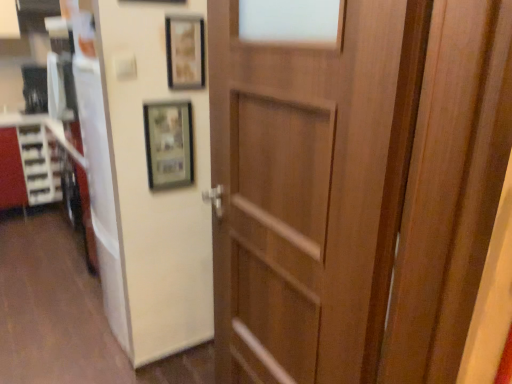
You are a GUI agent. You are given a task and a screenshot of the screen. Output one action in this format:
    pyautogui.click(x=<x>, y=<y>)
    Task: Click on the wooden door at center
    
    Given the screenshot: What is the action you would take?
    pyautogui.click(x=357, y=191)

Locate an element on the screen. This screenshot has width=512, height=384. matte wooden picture frame at upper center, which is the 2th picture frame from top to bottom is located at coordinates (169, 144).

This screenshot has width=512, height=384. What do you see at coordinates (11, 171) in the screenshot? I see `matte white cabinet at left` at bounding box center [11, 171].

I want to click on matte white cabinet at left, so click(x=11, y=171).

Locate an element on the screen. Image resolution: width=512 pixels, height=384 pixels. wooden frame at upper center, positioned as the second picture frame in bottom-to-top order is located at coordinates (185, 52).

Is wooden frame at upper center, which appears as the first picture frame when viewed from the top, surrounded by matte wooden picture frame at upper center, which is the 2th picture frame from top to bottom?

No.

How many degrees apart are the facing directions of matte wooden picture frame at upper center, the 1th picture frame positioned from the bottom, and wooden frame at upper center, positioned as the second picture frame in bottom-to-top order?

There is a 0.00366-degree angle between the facing directions of matte wooden picture frame at upper center, the 1th picture frame positioned from the bottom, and wooden frame at upper center, positioned as the second picture frame in bottom-to-top order.

Image resolution: width=512 pixels, height=384 pixels. What are the coordinates of `picture frame on the left of wooden frame at upper center, which appears as the first picture frame when viewed from the top` in the screenshot? It's located at (169, 144).

Is the position of matte wooden picture frame at upper center, which is the 2th picture frame from top to bottom, more distant than that of wooden frame at upper center, positioned as the second picture frame in bottom-to-top order?

Yes, matte wooden picture frame at upper center, which is the 2th picture frame from top to bottom, is further from the viewer.

Considering the relative sizes of wooden frame at upper center, positioned as the second picture frame in bottom-to-top order, and matte wooden picture frame at upper center, which is the 2th picture frame from top to bottom, in the image provided, is wooden frame at upper center, positioned as the second picture frame in bottom-to-top order, thinner than matte wooden picture frame at upper center, which is the 2th picture frame from top to bottom,?

No.

How far apart are wooden frame at upper center, which appears as the first picture frame when viewed from the top, and matte wooden picture frame at upper center, the 1th picture frame positioned from the bottom?

9.19 inches.

Which of these two, wooden frame at upper center, positioned as the second picture frame in bottom-to-top order, or matte wooden picture frame at upper center, the 1th picture frame positioned from the bottom, is bigger?

matte wooden picture frame at upper center, the 1th picture frame positioned from the bottom, is bigger.

Is wooden frame at upper center, which appears as the first picture frame when viewed from the top, facing towards matte wooden picture frame at upper center, which is the 2th picture frame from top to bottom?

No, wooden frame at upper center, which appears as the first picture frame when viewed from the top, is not aimed at matte wooden picture frame at upper center, which is the 2th picture frame from top to bottom.

Does point (464, 20) come farther from viewer compared to point (15, 164)?

No, (464, 20) is closer to viewer.

Is wooden door at center positioned in front of matte white cabinet at left?

That is True.

Considering the positions of objects wooden door at center and matte white cabinet at left in the image provided, who is more to the left, wooden door at center or matte white cabinet at left?

From the viewer's perspective, matte white cabinet at left appears more on the left side.

From a real-world perspective, which object rests below the other?

matte white cabinet at left, from a real-world perspective.

Can we say matte white cabinet at left lies outside wooden frame at upper center, positioned as the second picture frame in bottom-to-top order?

Yes.

Considering the relative sizes of matte white cabinet at left and wooden frame at upper center, which appears as the first picture frame when viewed from the top, in the image provided, is matte white cabinet at left shorter than wooden frame at upper center, which appears as the first picture frame when viewed from the top,?

No, matte white cabinet at left is not shorter than wooden frame at upper center, which appears as the first picture frame when viewed from the top.

Locate an element on the screen. The width and height of the screenshot is (512, 384). cabinetry directly beneath the wooden frame at upper center, which appears as the first picture frame when viewed from the top (from a real-world perspective) is located at coordinates (11, 171).

Is matte white cabinet at left next to wooden frame at upper center, positioned as the second picture frame in bottom-to-top order?

No, matte white cabinet at left is not in contact with wooden frame at upper center, positioned as the second picture frame in bottom-to-top order.

Is matte white cabinet at left completely or partially inside matte wooden picture frame at upper center, which is the 2th picture frame from top to bottom?

No.

Is point (150, 116) closer to camera compared to point (22, 176)?

Yes, point (150, 116) is in front of point (22, 176).

Could you tell me if matte wooden picture frame at upper center, which is the 2th picture frame from top to bottom, is facing matte white cabinet at left?

No.

From a real-world perspective, is matte white cabinet at left beneath wooden door at center?

Yes, from a real-world perspective, matte white cabinet at left is below wooden door at center.

Is point (11, 170) behind point (244, 69)?

That is True.

Would you say matte white cabinet at left contains wooden door at center?

No, wooden door at center is not a part of matte white cabinet at left.

Based on their positions, is matte white cabinet at left located to the left or right of wooden door at center?

matte white cabinet at left is to the left of wooden door at center.

Is wooden frame at upper center, positioned as the second picture frame in bottom-to-top order, located outside matte white cabinet at left?

Yes, wooden frame at upper center, positioned as the second picture frame in bottom-to-top order, is outside of matte white cabinet at left.

Can you confirm if wooden frame at upper center, positioned as the second picture frame in bottom-to-top order, is thinner than matte white cabinet at left?

Correct, the width of wooden frame at upper center, positioned as the second picture frame in bottom-to-top order, is less than that of matte white cabinet at left.

Which object is positioned more to the right, wooden frame at upper center, positioned as the second picture frame in bottom-to-top order, or matte white cabinet at left?

From the viewer's perspective, wooden frame at upper center, positioned as the second picture frame in bottom-to-top order, appears more on the right side.

Could you tell me if wooden frame at upper center, which appears as the first picture frame when viewed from the top, is facing matte white cabinet at left?

No, wooden frame at upper center, which appears as the first picture frame when viewed from the top, is not aimed at matte white cabinet at left.

You are a GUI agent. You are given a task and a screenshot of the screen. Output one action in this format:
    pyautogui.click(x=<x>, y=<y>)
    Task: Click on the picture frame below the wooden frame at upper center, which appears as the first picture frame when viewed from the top (from a real-world perspective)
    Image resolution: width=512 pixels, height=384 pixels.
    Given the screenshot: What is the action you would take?
    pyautogui.click(x=169, y=144)

Where is `picture frame above the matte wooden picture frame at upper center, the 1th picture frame positioned from the bottom (from the image's perspective)`? The width and height of the screenshot is (512, 384). picture frame above the matte wooden picture frame at upper center, the 1th picture frame positioned from the bottom (from the image's perspective) is located at coordinates (185, 52).

Looking at the image, which one is located further to matte white cabinet at left, wooden frame at upper center, which appears as the first picture frame when viewed from the top, or wooden door at center?

wooden door at center is further to matte white cabinet at left.

Considering their positions, is matte wooden picture frame at upper center, the 1th picture frame positioned from the bottom, positioned further to wooden frame at upper center, which appears as the first picture frame when viewed from the top, than matte white cabinet at left?

The object further to wooden frame at upper center, which appears as the first picture frame when viewed from the top, is matte white cabinet at left.

When comparing their distances from wooden door at center, does matte wooden picture frame at upper center, which is the 2th picture frame from top to bottom, or matte white cabinet at left seem further?

matte white cabinet at left is positioned further to the anchor wooden door at center.

Which object lies further to the anchor point wooden door at center, wooden frame at upper center, positioned as the second picture frame in bottom-to-top order, or matte white cabinet at left?

Based on the image, matte white cabinet at left appears to be further to wooden door at center.

From the image, which object appears to be nearer to matte wooden picture frame at upper center, which is the 2th picture frame from top to bottom, wooden frame at upper center, which appears as the first picture frame when viewed from the top, or wooden door at center?

Among the two, wooden frame at upper center, which appears as the first picture frame when viewed from the top, is located nearer to matte wooden picture frame at upper center, which is the 2th picture frame from top to bottom.

Considering their positions, is wooden frame at upper center, which appears as the first picture frame when viewed from the top, positioned closer to matte white cabinet at left than matte wooden picture frame at upper center, the 1th picture frame positioned from the bottom?

The object closer to matte white cabinet at left is matte wooden picture frame at upper center, the 1th picture frame positioned from the bottom.

Considering their positions, is matte wooden picture frame at upper center, the 1th picture frame positioned from the bottom, positioned closer to matte white cabinet at left than wooden frame at upper center, positioned as the second picture frame in bottom-to-top order?

matte wooden picture frame at upper center, the 1th picture frame positioned from the bottom, is closer to matte white cabinet at left.

Estimate the real-world distances between objects in this image. Which object is further from matte wooden picture frame at upper center, the 1th picture frame positioned from the bottom, wooden frame at upper center, which appears as the first picture frame when viewed from the top, or matte white cabinet at left?

matte white cabinet at left is further to matte wooden picture frame at upper center, the 1th picture frame positioned from the bottom.

Identify the location of picture frame between matte white cabinet at left and wooden frame at upper center, positioned as the second picture frame in bottom-to-top order, in the horizontal direction. (169, 144).

At what (x,y) coordinates should I click in order to perform the action: click on picture frame between wooden door at center and matte wooden picture frame at upper center, the 1th picture frame positioned from the bottom, along the z-axis. Please return your answer as a coordinate pair (x, y). Looking at the image, I should click on (185, 52).